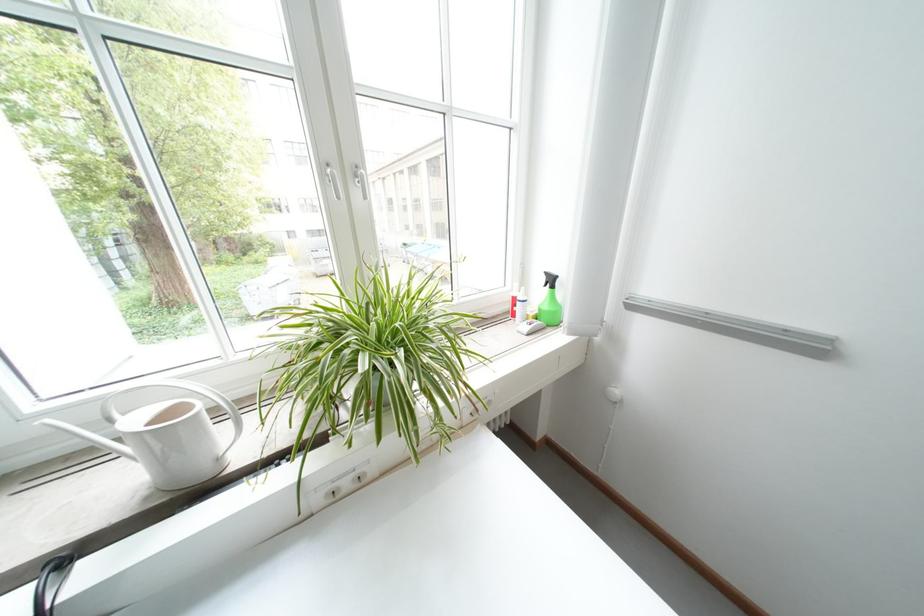
You are a GUI agent. You are given a task and a screenshot of the screen. Output one action in this format:
    pyautogui.click(x=<x>, y=<y>)
    Task: Click on the spray bottle trigger
    The width and height of the screenshot is (924, 616).
    Given the screenshot: What is the action you would take?
    pyautogui.click(x=550, y=302)